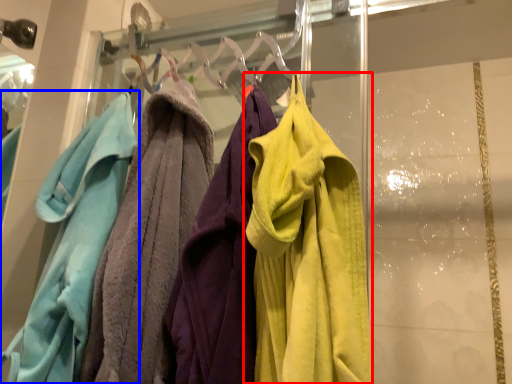
Question: Which object is further to the camera taking this photo, towel (highlighted by a red box) or towel (highlighted by a blue box)?

Choices:
 (A) towel
 (B) towel

Answer: (B)